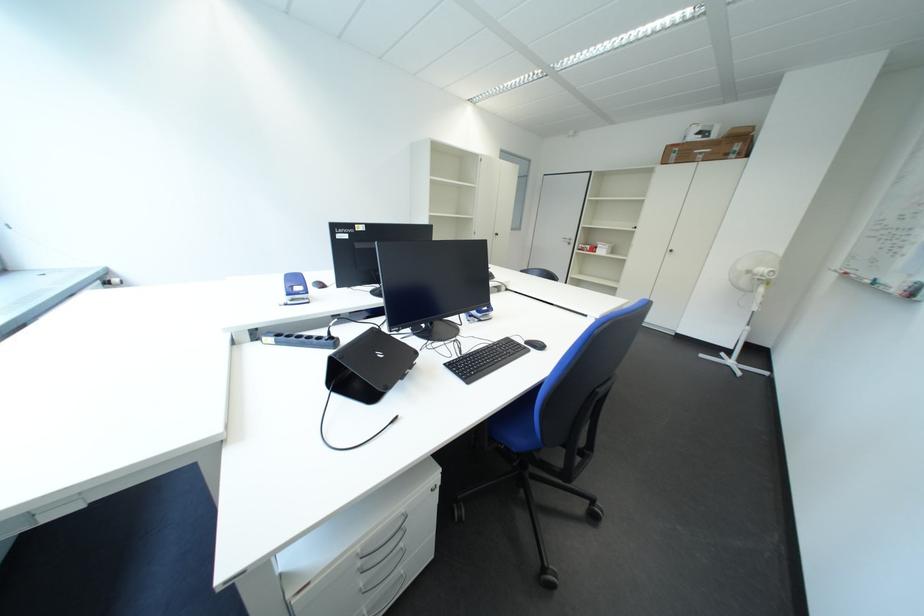
Where would you insert the cabinet lock? Please return your answer as a coordinate pair (x, y).

(433, 487)